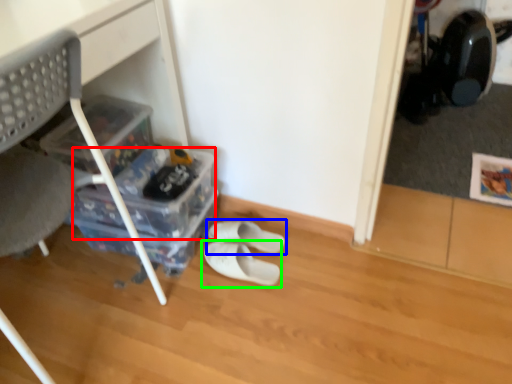
Question: Which is nearer to the storage box (highlighted by a red box)? footwear (highlighted by a blue box) or footwear (highlighted by a green box).

Choices:
 (A) footwear
 (B) footwear

Answer: (A)